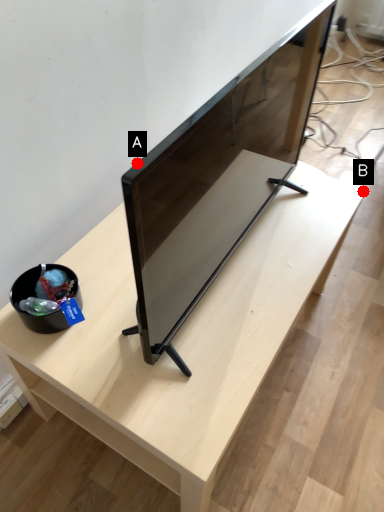
Question: Two points are circled on the image, labeled by A and B beside each circle. Which point is farther from the camera taking this photo?

Choices:
 (A) A is further
 (B) B is further

Answer: (B)